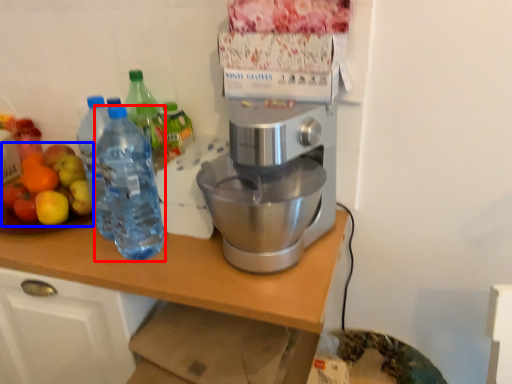
Question: Which of the following is the closest to the observer, bottle (highlighted by a red box) or fruit salad (highlighted by a blue box)?

Choices:
 (A) bottle
 (B) fruit salad

Answer: (A)